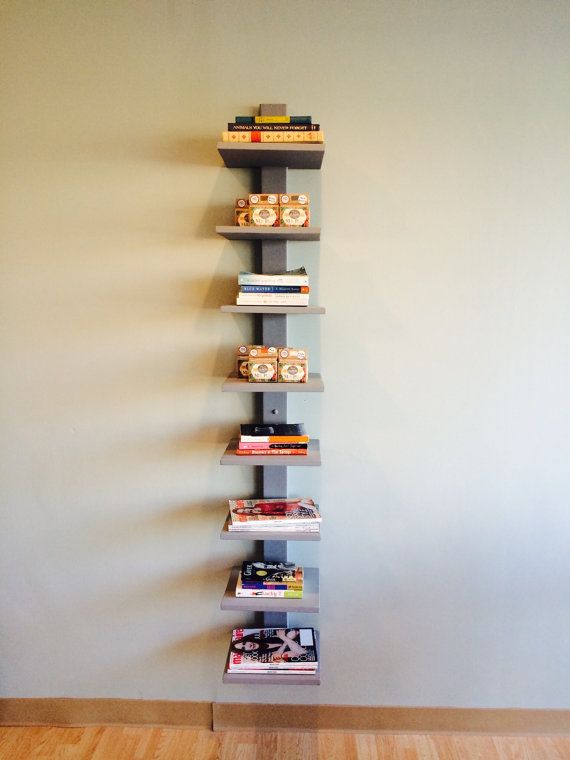
You are a GUI agent. You are given a task and a screenshot of the screen. Output one action in this format:
    pyautogui.click(x=<x>, y=<y>)
    Task: Click on the shelves with something on them
    Image resolution: width=570 pixels, height=760 pixels.
    Given the screenshot: What is the action you would take?
    pyautogui.click(x=258, y=676), pyautogui.click(x=270, y=605), pyautogui.click(x=267, y=536), pyautogui.click(x=271, y=464), pyautogui.click(x=266, y=388), pyautogui.click(x=280, y=315), pyautogui.click(x=272, y=235), pyautogui.click(x=284, y=147)